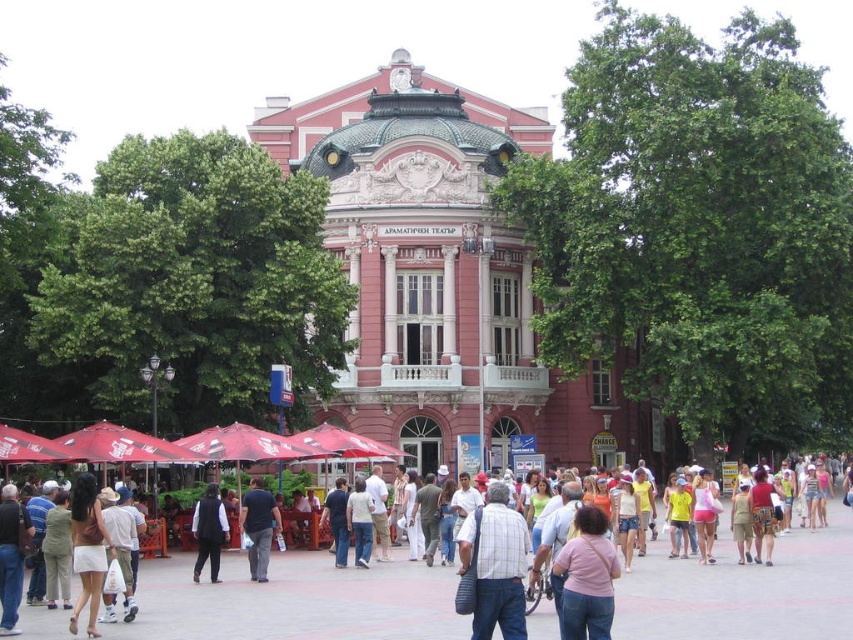
You are a photographer trying to capture a candid shot of the two people in the crowd. The pink fabric shirt at center and the black leather vest at center are both in your frame. If you want to focus on the person with the thinner clothing, which one should you adjust your camera to focus on?

The pink fabric shirt at center is thinner than the black leather vest at center, so you should focus on the person wearing the pink fabric shirt at center.

You are a photographer positioned at the edge of the square, aiming to capture both the matte white skirt at lower left and the dark blue shirt at center in a single frame. Given that your camera has a focal length of 50mm, which is suitable for capturing subjects within a 6 meter range, will you be able to include both subjects in your shot?

The matte white skirt at lower left and dark blue shirt at center are 11.72 meters apart from each other. Since the camera can only capture subjects within a 6 meter range, the distance between them exceeds the camera capabilities. Therefore, you cannot include both in a single frame.

You are a photographer trying to capture both the dark blue shirt at center and the black leather vest at center in a single frame. Based on their sizes, which one should you focus on to ensure both are clearly visible in the photo?

Since the dark blue shirt at center is smaller than the black leather vest at center, you should focus on the dark blue shirt at center to ensure both are clearly visible in the photo.